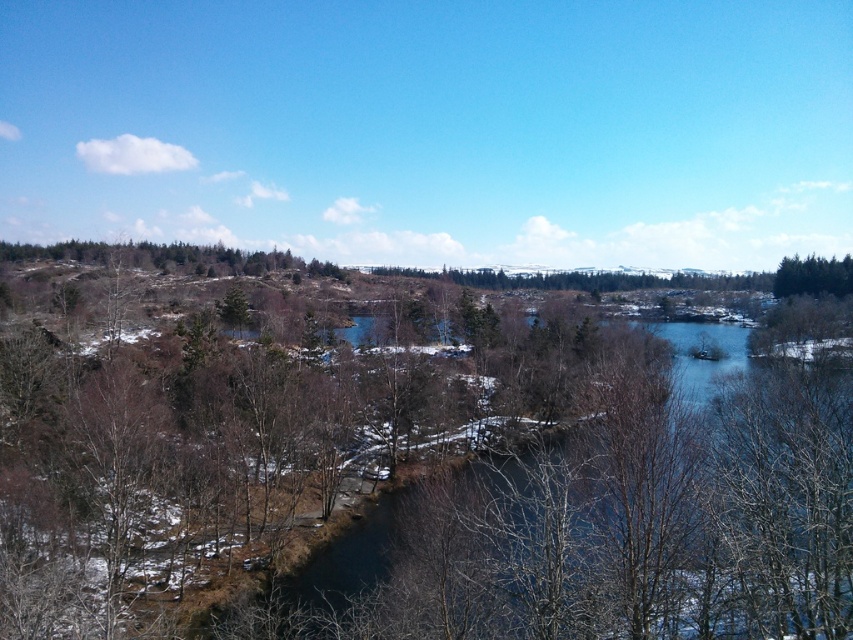
You are standing in the snowy landscape and want to take a photo of the brown leafless tree at center. If you are currently 60.77 feet away from it, is that a good distance for a clear photo?

Yes, the brown leafless tree at center is 60.77 feet away from you, which is a good distance for a clear photo as it allows capturing the tree in its entirety while maintaining sharpness.

You are standing at the point with coordinates (426, 483) in the image. What object is located exactly at that point?

The brown leafless tree at center is located exactly at point (426, 483).

You are standing in the snowy landscape looking at the lake. There are two points marked in the image. One is at coordinate point(x=537, y=522) and the other at point(x=851, y=266). Which point is closer to you?

Point(x=537, y=522) is closer to the camera than point(x=851, y=266).